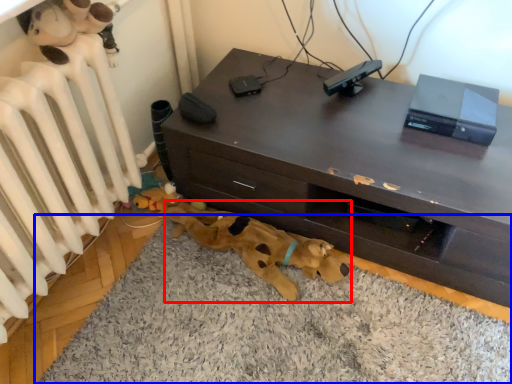
Question: Which of the following is the closest to the observer, toy (highlighted by a red box) or dog bed (highlighted by a blue box)?

Choices:
 (A) toy
 (B) dog bed

Answer: (B)